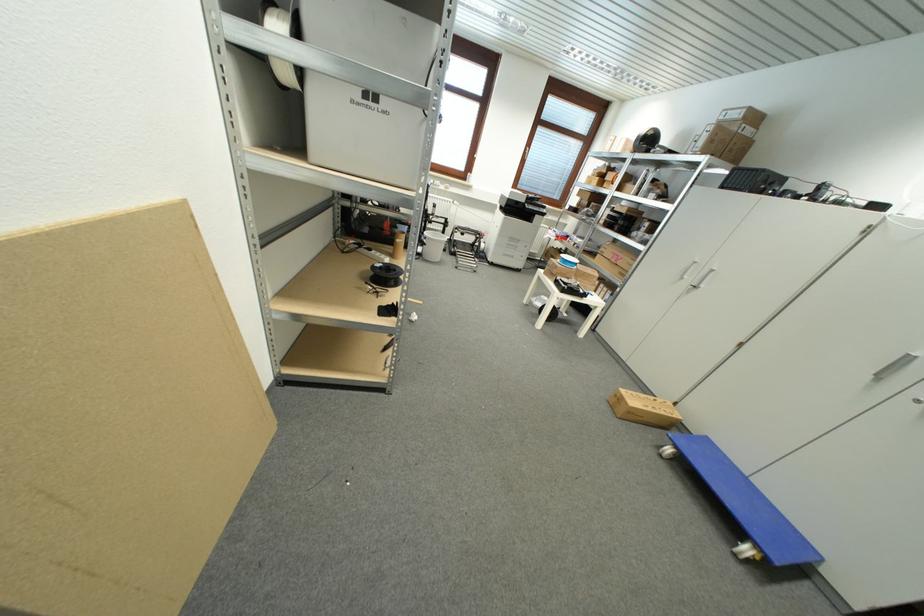
Find where to lift the white filament spool. Please return your answer as a coordinate pair (x, y).

(432, 246)